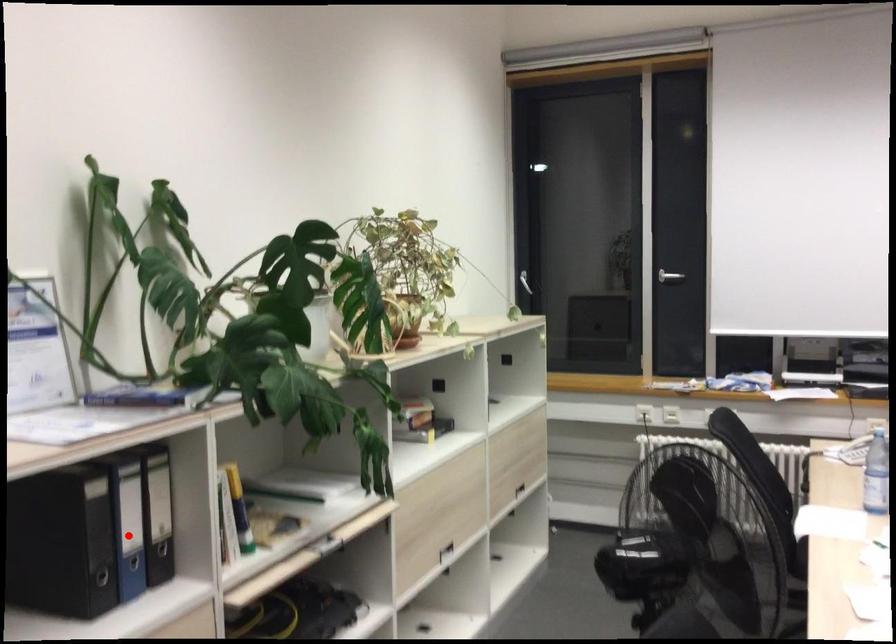
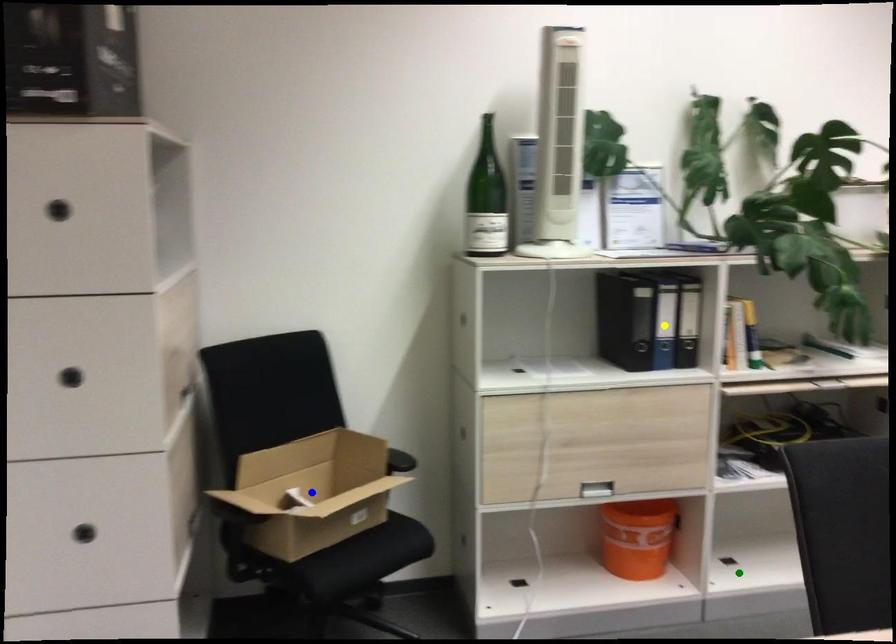
Question: I am providing you with two images of the same scene from different viewpoints. A red point is marked on the first image. You are given multiple points on the second image. Which mark in image 2 goes with the point in image 1?

Choices:
 (A) blue point
 (B) yellow point
 (C) green point

Answer: (B)